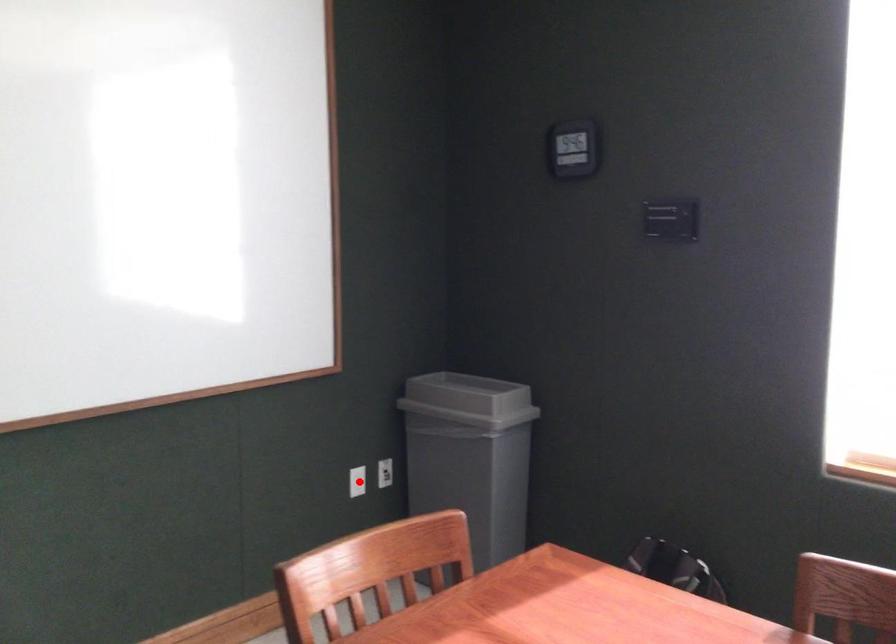
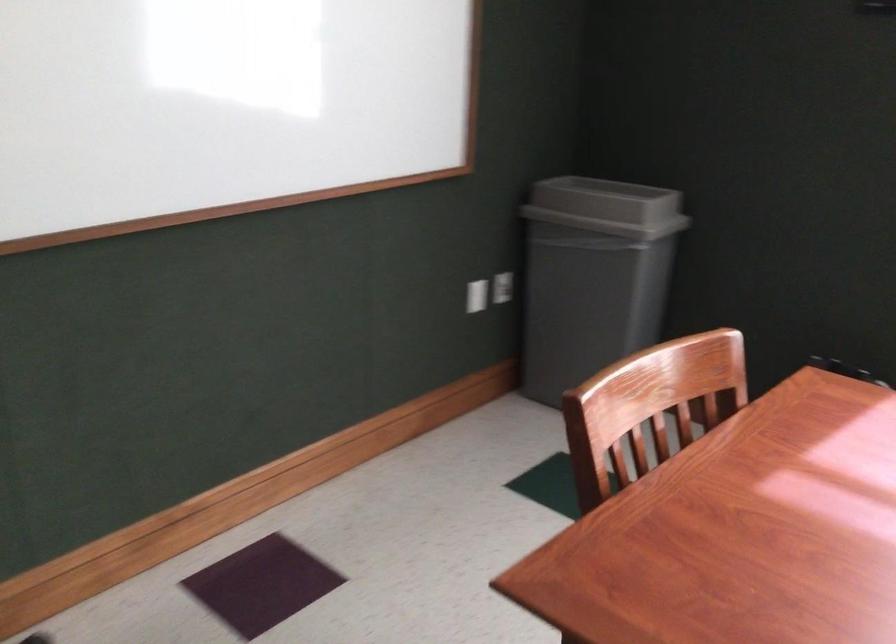
In the second image, find the point that corresponds to the highlighted location in the first image.

(477, 295)